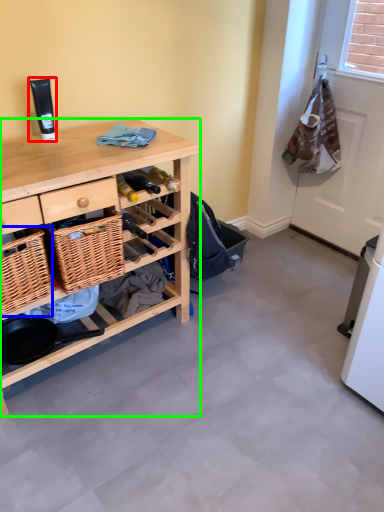
Question: Based on their relative distances, which object is nearer to toiletry (highlighted by a red box)? Choose from picnic basket (highlighted by a blue box) and desk (highlighted by a green box).

Choices:
 (A) picnic basket
 (B) desk

Answer: (B)